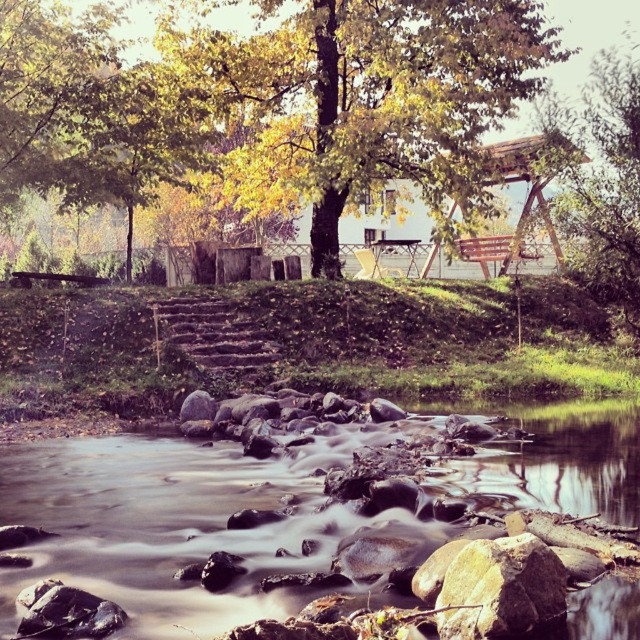
Based on the scene description, where is the green leafy tree at upper center located in terms of coordinates?

The green leafy tree at upper center is located at point coordinates of (602, 182).

You are planning to take a photo of the green leafy tree at upper center and the brown wooden stairs at center from a position where both are visible. Based on their sizes in the image, which object would appear bigger in your photo?

The green leafy tree at upper center appears bigger in the photo because it has a larger size compared to the brown wooden stairs at center.

You are planning to cross the stream using the smooth rock river at lower center and the brown wooden stairs at center. Which path is shorter in length?

The smooth rock river at lower center is shorter than the brown wooden stairs at center, so the smooth rock river at lower center is the shorter path.